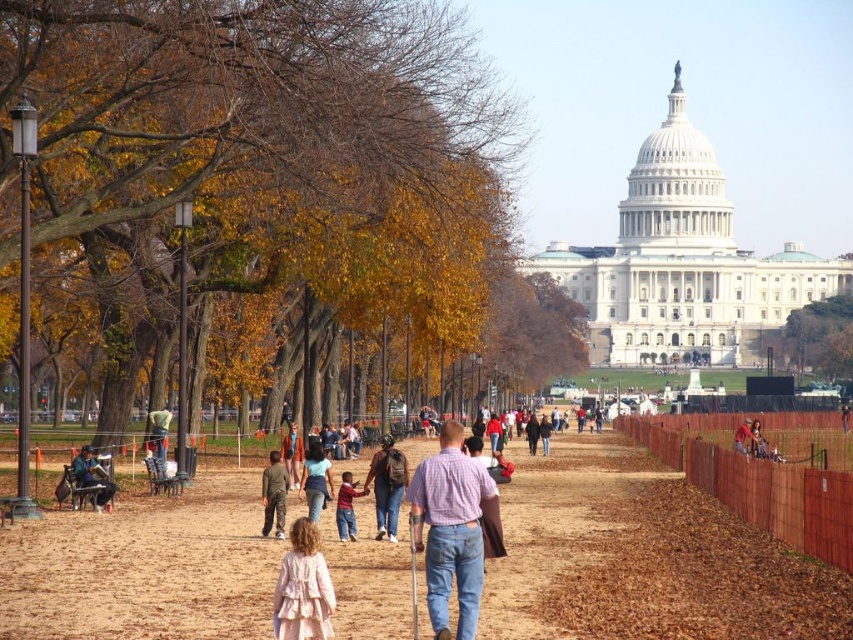
From the picture: You are standing at the point closer to the camera between the two points, point (328, 202) and point (271, 506). Which point are you standing at?

You are standing at point (328, 202) because it is further to the camera than point (271, 506).

You are standing on the National Mall and see both the striped knit sweater at center and the denim jacket at center. Which item is nearer to you?

The striped knit sweater at center is closer to the viewer than the denim jacket at center.

You are a photographer standing at the National Mall and see both the striped knit sweater at center and the denim jacket at center. Which item is positioned lower in the image?

The striped knit sweater at center is below the denim jacket at center, so it is positioned lower in the image.